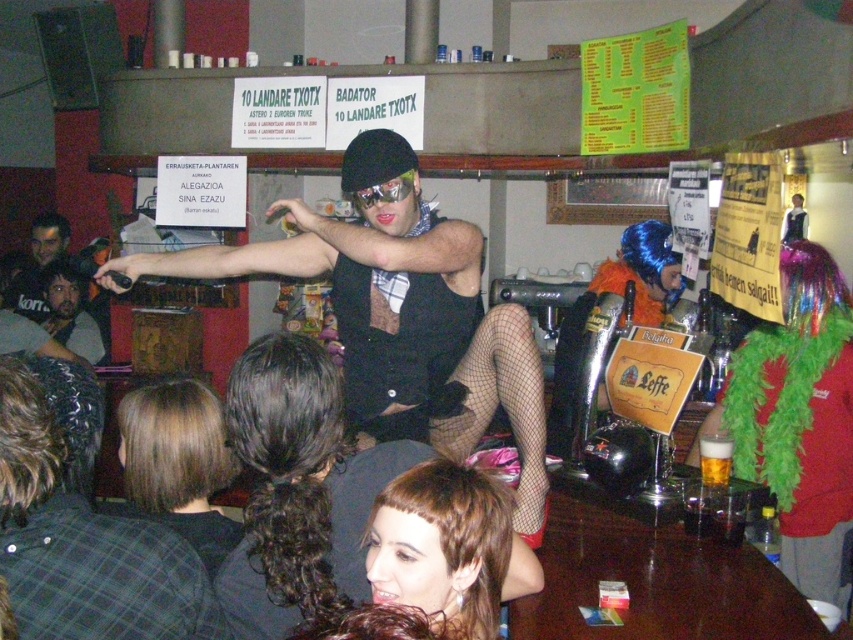
Is black mesh stockings at center taller than blonde hair at lower left?

Yes.

Who is positioned more to the right, black mesh stockings at center or blonde hair at lower left?

From the viewer's perspective, black mesh stockings at center appears more on the right side.

Does point (354, 298) come closer to viewer compared to point (132, 483)?

No.

Where is `black mesh stockings at center`? The image size is (853, 640). black mesh stockings at center is located at coordinates (399, 312).

Who is more forward, (416, 506) or (62, 244)?

Point (416, 506) is in front.

Is shiny brown hair at lower center below matte black shirt at center?

Yes.

The width and height of the screenshot is (853, 640). I want to click on shiny brown hair at lower center, so click(445, 547).

Does shiny brown hair at lower center appear on the left side of blonde hair at lower left?

Incorrect, shiny brown hair at lower center is not on the left side of blonde hair at lower left.

Between shiny brown hair at lower center and blonde hair at lower left, which one appears on the right side from the viewer's perspective?

From the viewer's perspective, shiny brown hair at lower center appears more on the right side.

Who is more forward, (376, 596) or (200, 496)?

Point (376, 596) is more forward.

Locate an element on the screen. The image size is (853, 640). shiny brown hair at lower center is located at coordinates (445, 547).